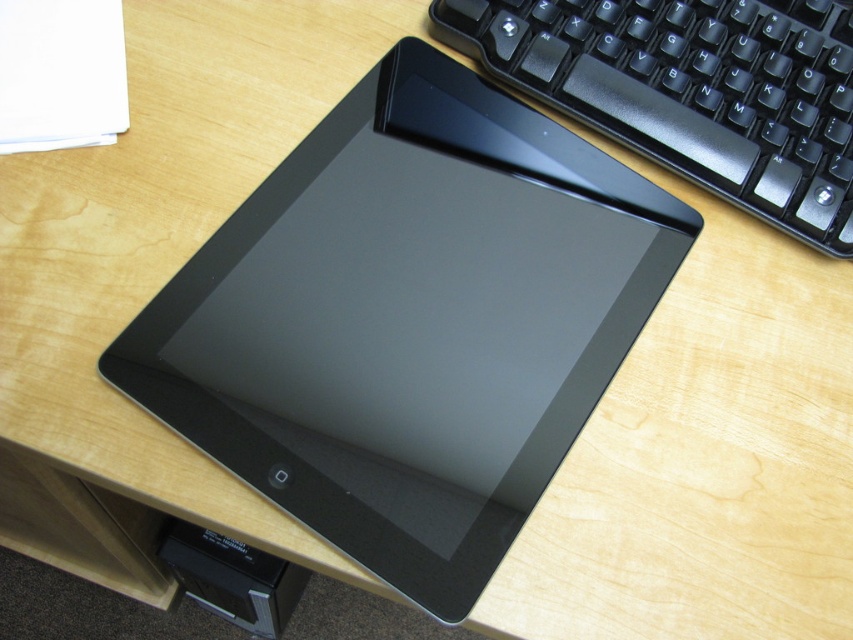
Between point (306, 472) and point (701, 102), which one is positioned in front?

Point (306, 472) is more forward.

Can you confirm if sleek black tablet at center is positioned to the left of black plastic keyboard at upper right?

Indeed, sleek black tablet at center is positioned on the left side of black plastic keyboard at upper right.

Who is more forward, (386, 444) or (527, 52)?

Point (386, 444) is more forward.

This screenshot has width=853, height=640. I want to click on sleek black tablet at center, so pos(410,321).